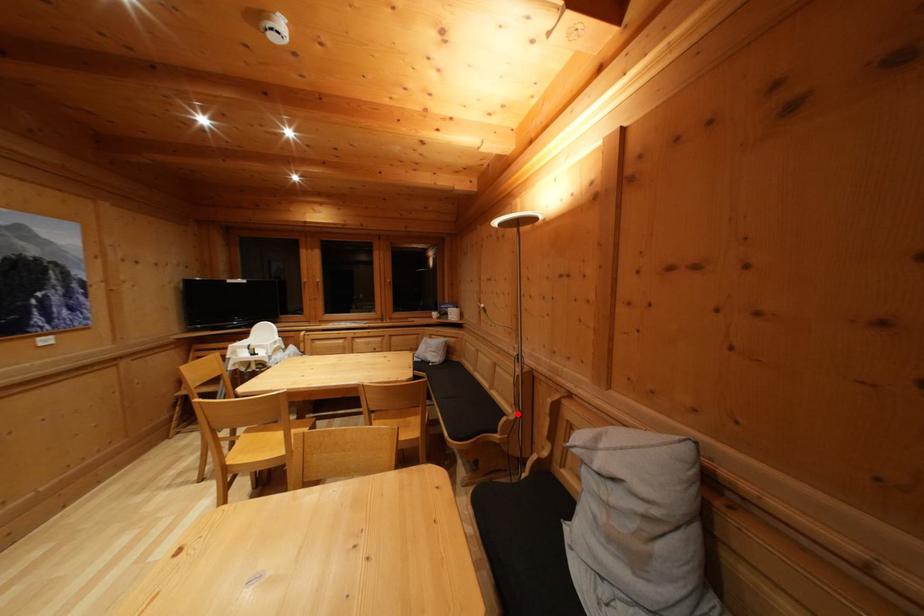
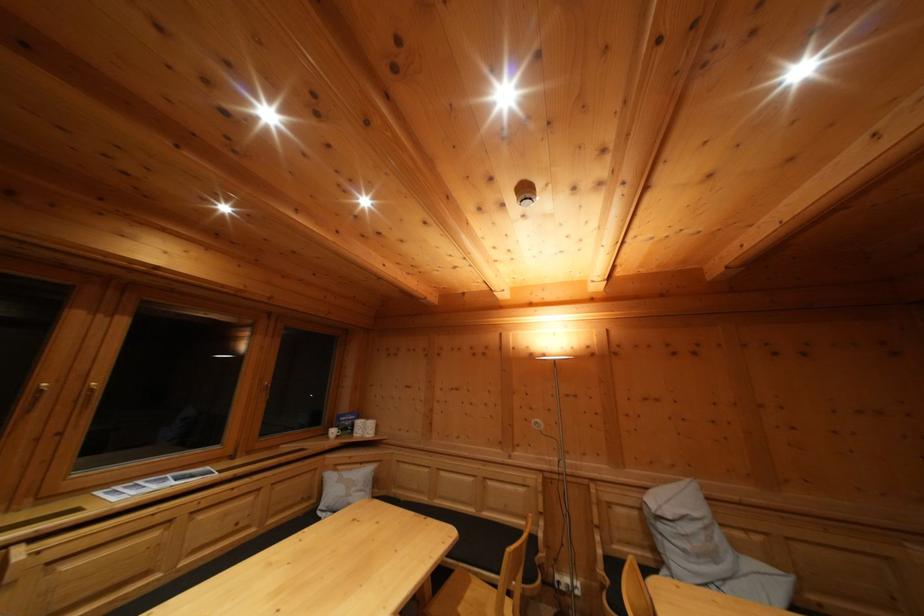
In the second image, find the point that corresponds to the highlighted location in the first image.

(532, 525)